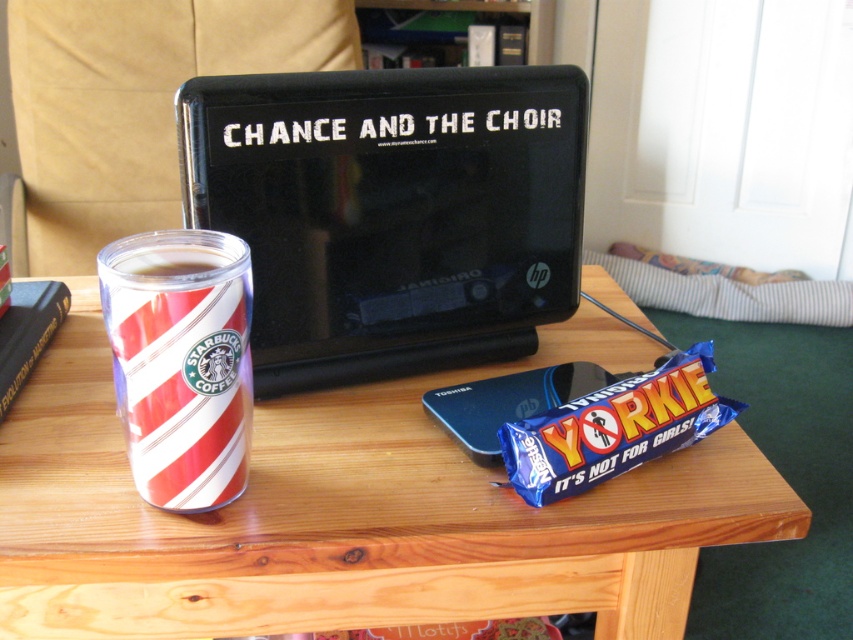
Question: Is the position of candy-striped can at left more distant than that of blue foil yorkie bar at lower right?

Choices:
 (A) no
 (B) yes

Answer: (A)

Question: Which point is farther from the camera taking this photo?

Choices:
 (A) (706, 445)
 (B) (200, 154)
 (C) (0, 419)

Answer: (C)

Question: Among these points, which one is farthest from the camera?

Choices:
 (A) (595, 564)
 (B) (141, 429)
 (C) (36, 349)
 (D) (573, 438)

Answer: (C)

Question: From the image, what is the correct spatial relationship of black matte laptop at center in relation to candy-striped can at left?

Choices:
 (A) left
 (B) right

Answer: (B)

Question: Does wooden table at center have a greater width compared to candy-striped can at left?

Choices:
 (A) no
 (B) yes

Answer: (B)

Question: Which object appears farthest from the camera in this image?

Choices:
 (A) candy-striped can at left
 (B) black matte laptop at center

Answer: (B)